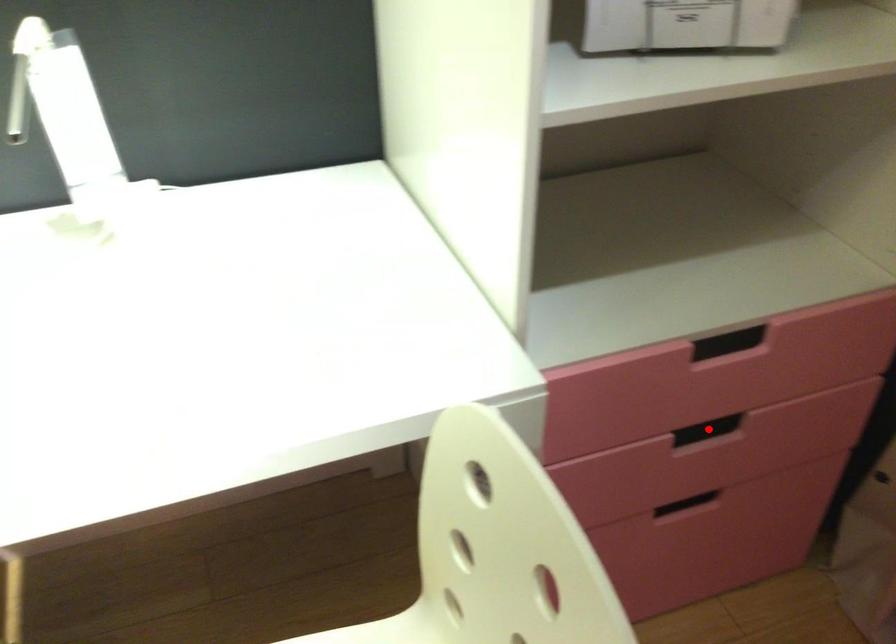
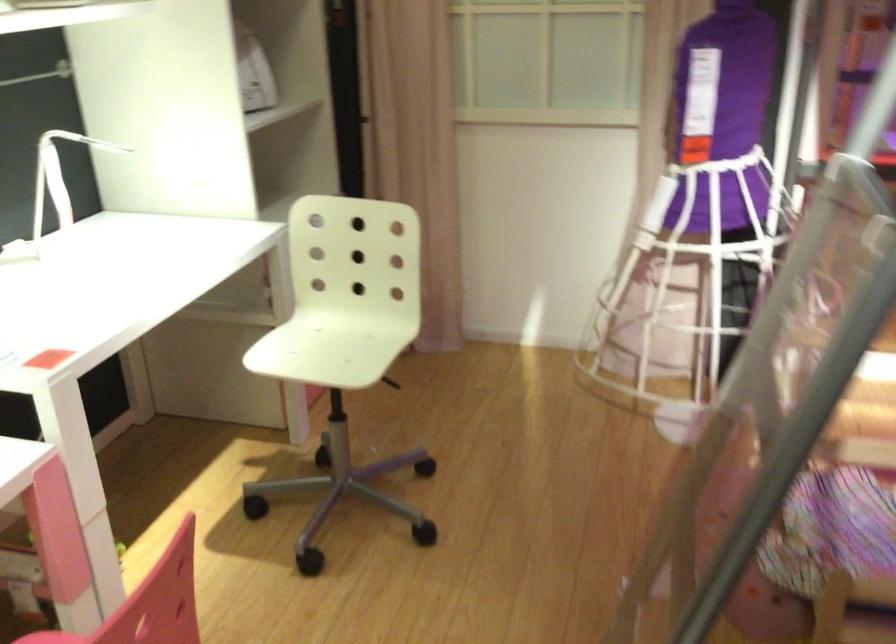
Question: I am providing you with two images of the same scene from different viewpoints. A red point is marked on the first image. Can you still see the location of the red point in image 2?

Choices:
 (A) Yes
 (B) No

Answer: (B)